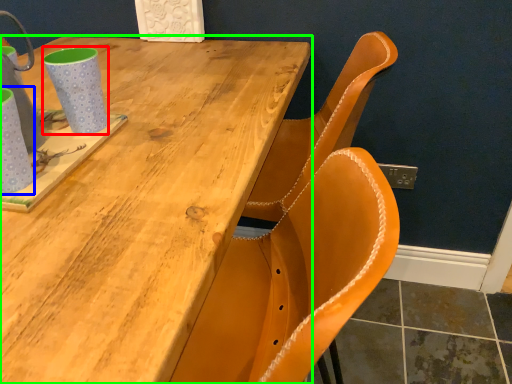
Question: Which object is positioned closest to mug (highlighted by a red box)? Select from mug (highlighted by a blue box) and table (highlighted by a green box).

Choices:
 (A) mug
 (B) table

Answer: (A)